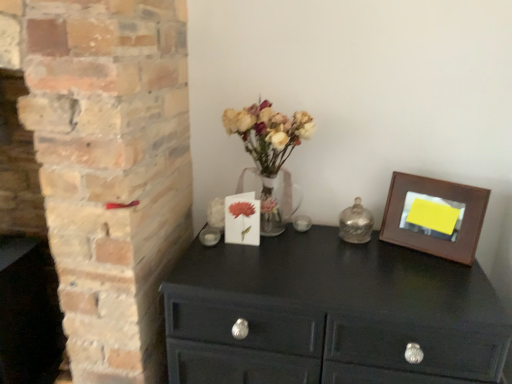
Question: Is matte black chest of drawers at center positioned beyond the bounds of shiny metallic bell at center-right?

Choices:
 (A) yes
 (B) no

Answer: (A)

Question: Does matte black chest of drawers at center appear on the left side of shiny metallic bell at center-right?

Choices:
 (A) no
 (B) yes

Answer: (B)

Question: Is matte black chest of drawers at center further to the viewer compared to shiny metallic bell at center-right?

Choices:
 (A) yes
 (B) no

Answer: (B)

Question: Is the position of matte black chest of drawers at center less distant than that of shiny metallic bell at center-right?

Choices:
 (A) yes
 (B) no

Answer: (A)

Question: Is matte black chest of drawers at center shorter than shiny metallic bell at center-right?

Choices:
 (A) yes
 (B) no

Answer: (B)

Question: Considering the positions of brown wooden picture frame at upper right and brick fireplace at left in the image, is brown wooden picture frame at upper right taller or shorter than brick fireplace at left?

Choices:
 (A) short
 (B) tall

Answer: (A)

Question: Considering the positions of brown wooden picture frame at upper right and brick fireplace at left in the image, is brown wooden picture frame at upper right wider or thinner than brick fireplace at left?

Choices:
 (A) wide
 (B) thin

Answer: (B)

Question: Is brown wooden picture frame at upper right bigger or smaller than brick fireplace at left?

Choices:
 (A) small
 (B) big

Answer: (A)

Question: Is point (393, 216) closer or farther from the camera than point (8, 220)?

Choices:
 (A) farther
 (B) closer

Answer: (B)

Question: From the image's perspective, is shiny metallic bell at center-right located above or below brick fireplace at left?

Choices:
 (A) above
 (B) below

Answer: (A)

Question: From a real-world perspective, is shiny metallic bell at center-right above or below brick fireplace at left?

Choices:
 (A) below
 (B) above

Answer: (B)

Question: Considering the positions of shiny metallic bell at center-right and brick fireplace at left in the image, is shiny metallic bell at center-right wider or thinner than brick fireplace at left?

Choices:
 (A) wide
 (B) thin

Answer: (B)

Question: Considering the relative positions of shiny metallic bell at center-right and brick fireplace at left in the image provided, is shiny metallic bell at center-right to the left or to the right of brick fireplace at left?

Choices:
 (A) right
 (B) left

Answer: (A)

Question: Considering the positions of point (14, 221) and point (192, 294), is point (14, 221) closer or farther from the camera than point (192, 294)?

Choices:
 (A) closer
 (B) farther

Answer: (B)

Question: In terms of width, does brick fireplace at left look wider or thinner when compared to matte black chest of drawers at center?

Choices:
 (A) wide
 (B) thin

Answer: (B)